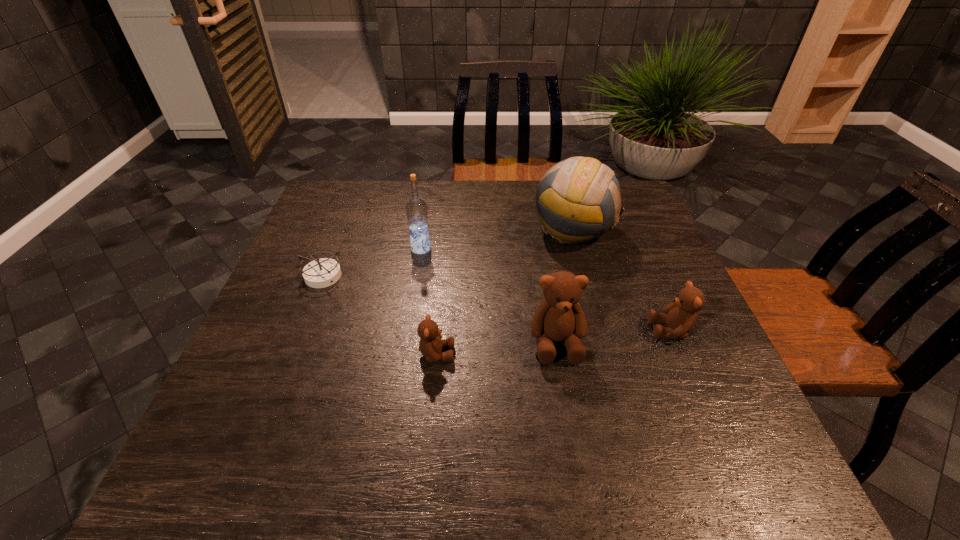
Please point a spot to add another teddy bear on the left. Please provide its 2D coordinates. Your answer should be formatted as a tuple, i.e. [(x, y)], where the tuple contains the x and y coordinates of a point satisfying the conditions above.

[(310, 367)]